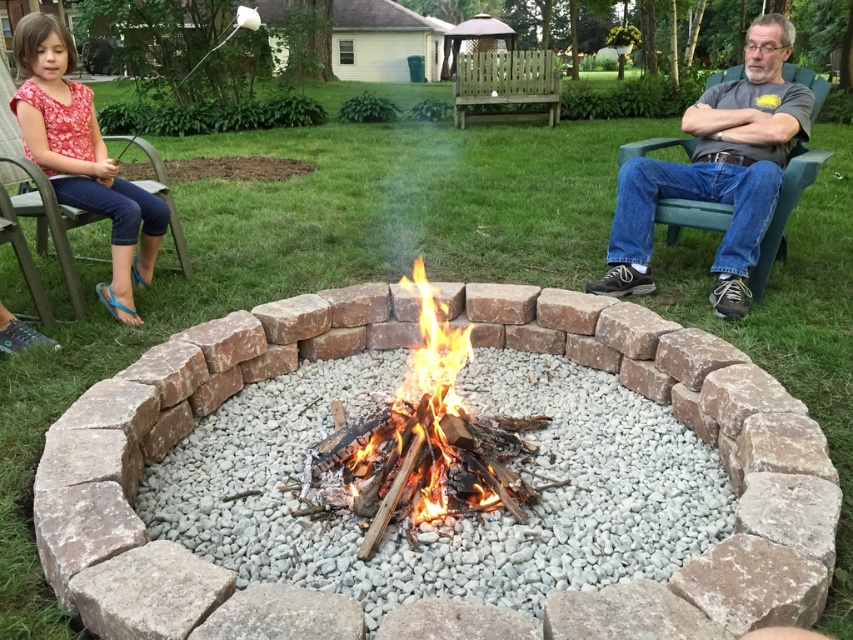
The width and height of the screenshot is (853, 640). What do you see at coordinates (170, 445) in the screenshot? I see `red brick fire pit at center` at bounding box center [170, 445].

Based on the photo, does red brick fire pit at center have a greater width compared to flaming wood fire at center?

Yes.

This screenshot has width=853, height=640. Find the location of `red brick fire pit at center`. red brick fire pit at center is located at coordinates (170, 445).

Is red brick fire pit at center smaller than gray t-shirt at right?

Incorrect, red brick fire pit at center is not smaller in size than gray t-shirt at right.

Who is taller, red brick fire pit at center or gray t-shirt at right?

With more height is gray t-shirt at right.

Which is in front, point (397, 336) or point (807, 115)?

Point (397, 336) is in front.

Locate an element on the screen. Image resolution: width=853 pixels, height=640 pixels. red brick fire pit at center is located at coordinates (170, 445).

Is gray t-shirt at right shorter than flaming wood fire at center?

Incorrect, gray t-shirt at right's height does not fall short of flaming wood fire at center's.

Is point (734, 280) positioned after point (433, 314)?

That is True.

Measure the distance between point (793, 84) and camera.

A: They are 3.88 meters apart.

At what (x,y) coordinates should I click in order to perform the action: click on gray t-shirt at right. Please return your answer as a coordinate pair (x, y). Looking at the image, I should click on (717, 172).